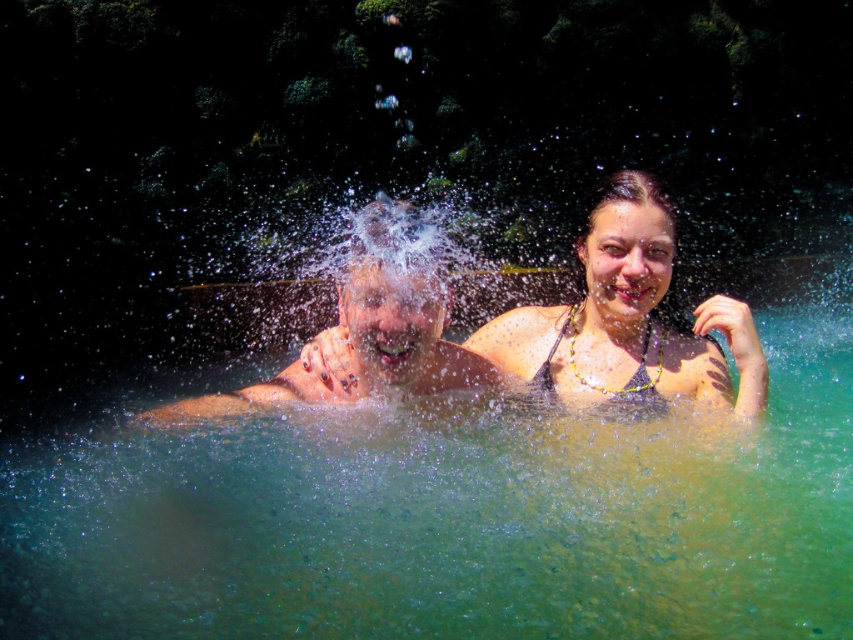
You are a photographer trying to capture a closeup shot of the multicolored beaded necklace at upper right and the black textured bikini top at center. Given that your camera has a maximum focus range of 4 inches, can you focus on both objects simultaneously?

The distance between the multicolored beaded necklace at upper right and the black textured bikini top at center is 4.35 inches, which exceeds the camera maximum focus range of 4 inches. Therefore, you cannot focus on both objects simultaneously.